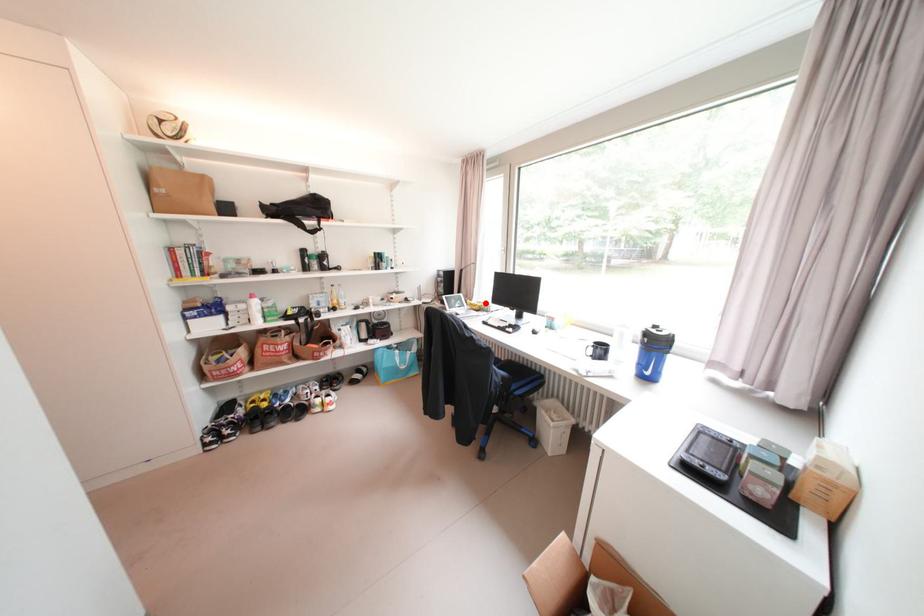
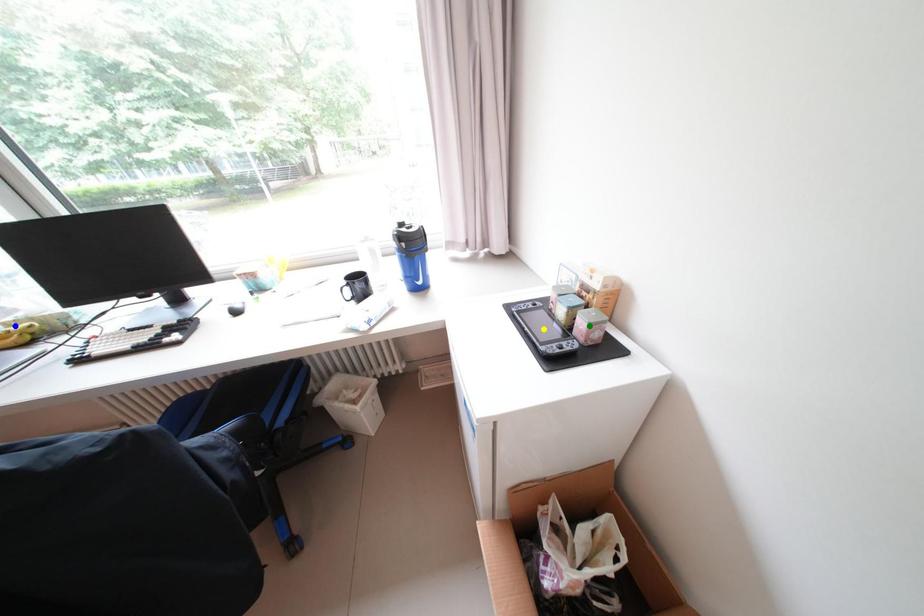
Question: I am providing you with two images of the same scene from different viewpoints. A red point is marked on the first image. You are given multiple points on the second image. Which point in image 2 is actually the same real-world point as the red point in image 1?

Choices:
 (A) green point
 (B) blue point
 (C) yellow point

Answer: (B)